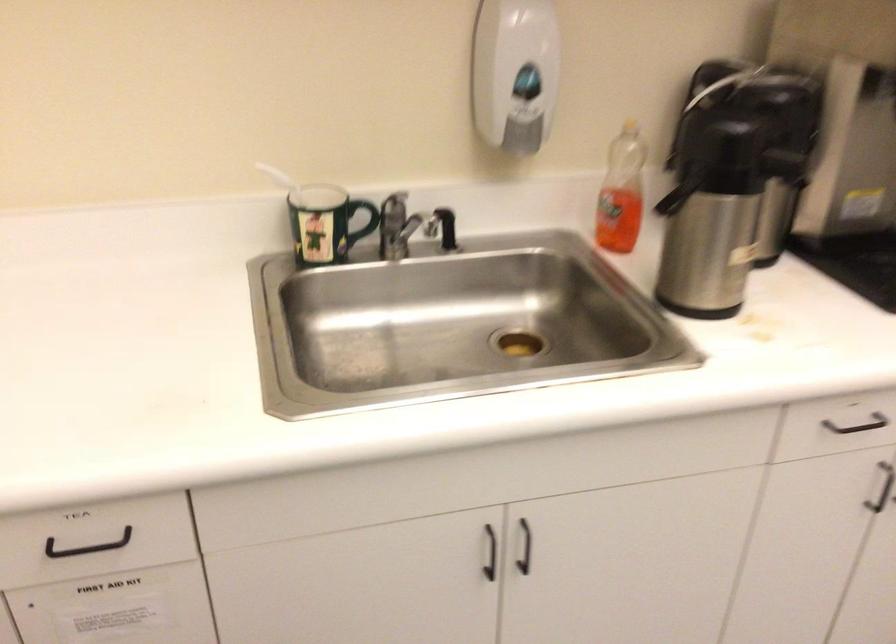
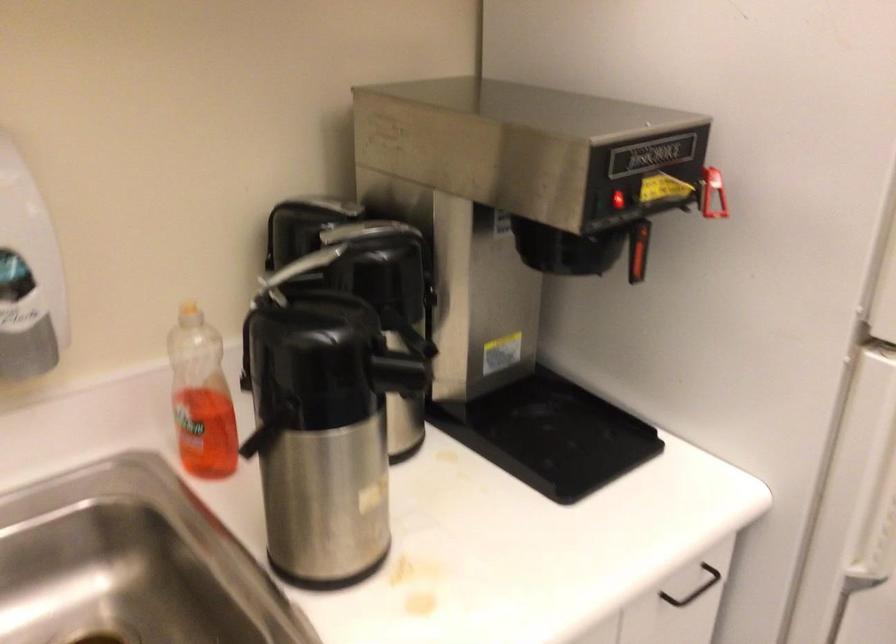
In a continuous first-person perspective shot, in which direction is the camera moving?

The cameraman walked toward right, forward.